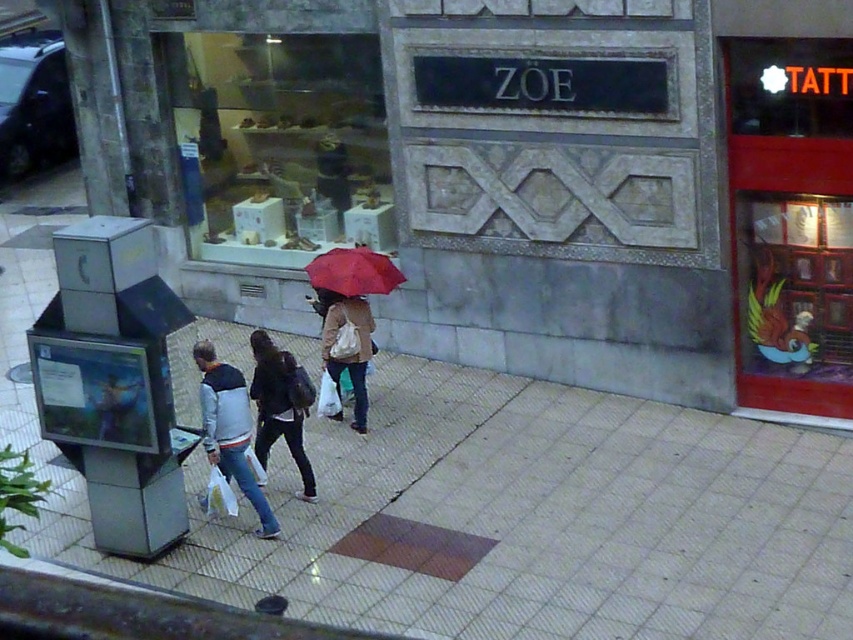
You are standing on the smooth concrete pavement at center and want to place the red matte umbrella at center on it. Can the umbrella fit on the pavement?

The smooth concrete pavement at center is much taller than the red matte umbrella at center, so the umbrella can fit on the pavement since it is shorter than the pavement.

You are standing on the street and see the matte brown coat at center and the red matte umbrella at center. Which object is closer to you?

The matte brown coat at center is closer to you because it is further to the viewer than the red matte umbrella at center.